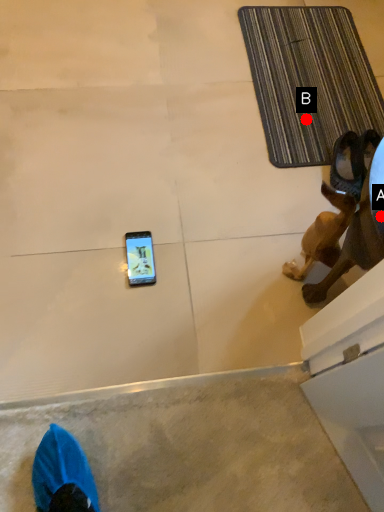
Question: Two points are circled on the image, labeled by A and B beside each circle. Which of the following is the farthest from the observer?

Choices:
 (A) A is further
 (B) B is further

Answer: (B)